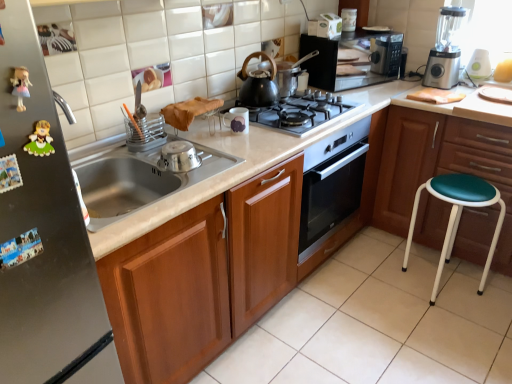
This screenshot has height=384, width=512. In order to click on free space in front of teal vinyl stool at lower right in this screenshot , I will do `click(455, 332)`.